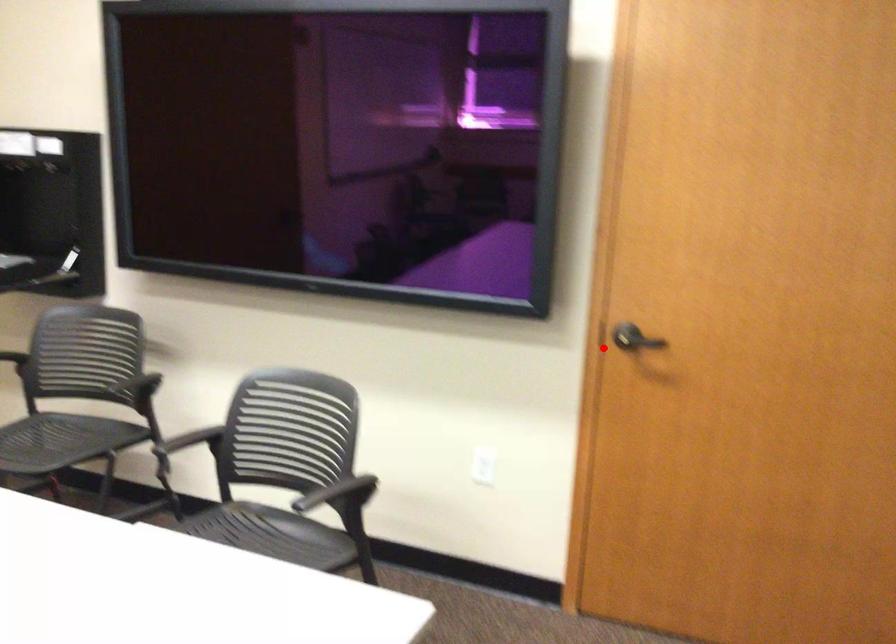
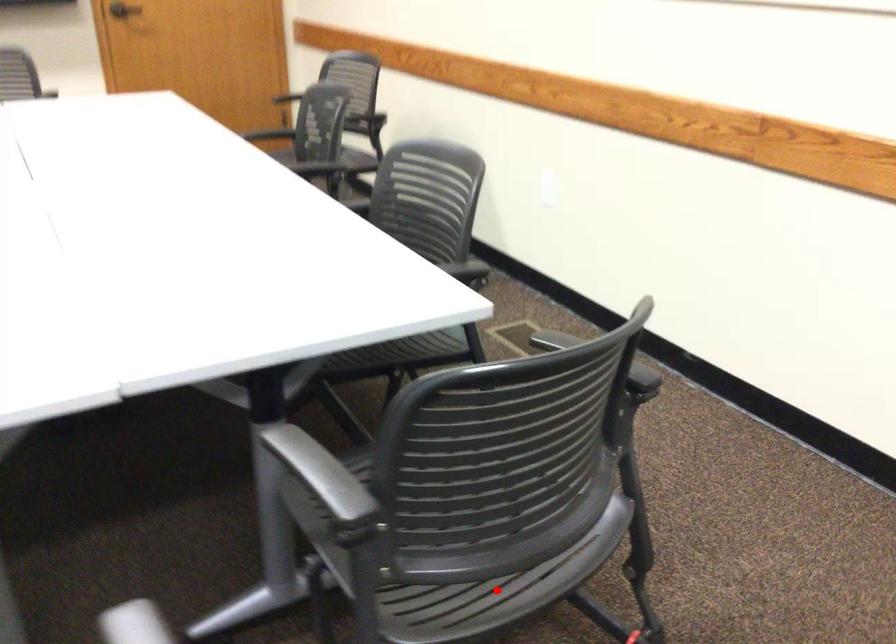
I am providing you with two images of the same scene from different viewpoints. A red point is marked on the first image and another point is marked on the second image. Does the point marked in image1 correspond to the same location as the one in image2?

No